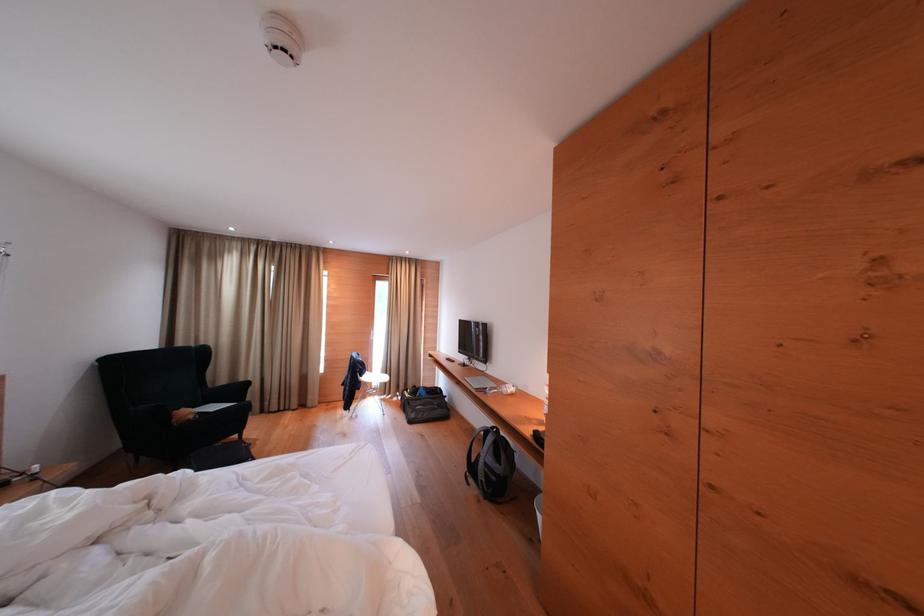
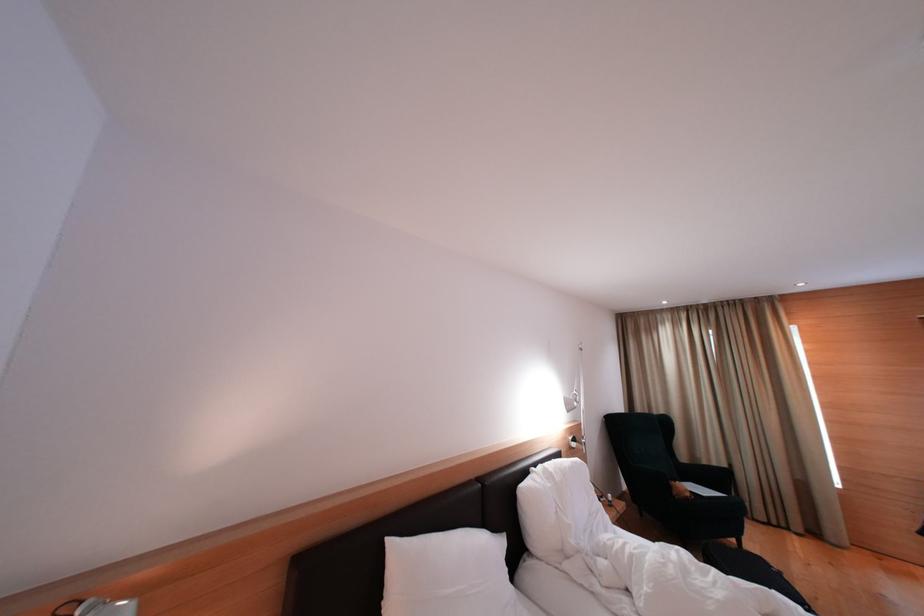
Question: The camera is either moving clockwise (left) or counter-clockwise (right) around the object. The first image is from the beginning of the video and the second image is from the end. Is the camera moving left or right when shooting the video?

Choices:
 (A) Left
 (B) Right

Answer: (B)